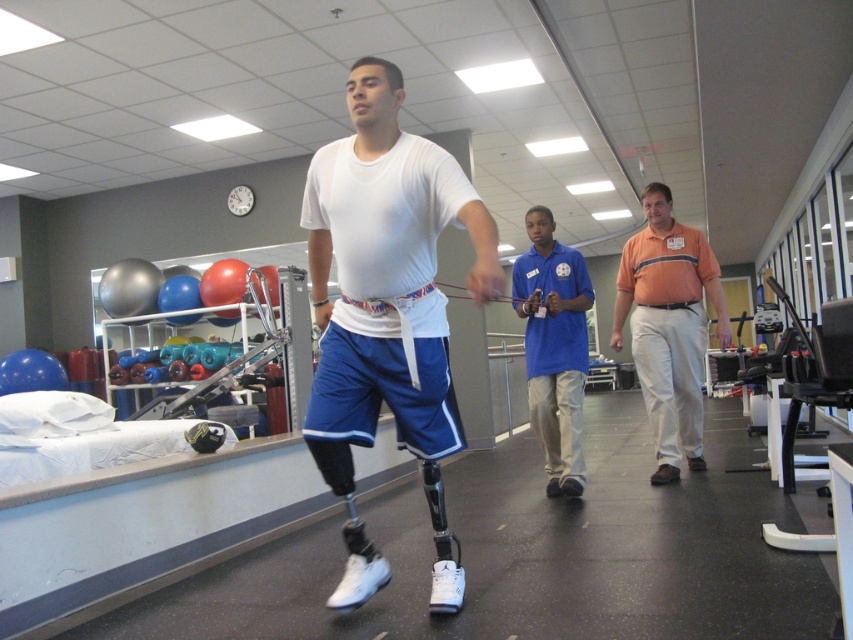
Can you confirm if white matte/soft fabric shirt at center is positioned above blue cotton shirt at center?

Yes.

Is white matte/soft fabric shirt at center below blue cotton shirt at center?

No.

Is point (433, 448) closer to camera compared to point (560, 417)?

Yes, it is.

Where is `white matte/soft fabric shirt at center`? The height and width of the screenshot is (640, 853). white matte/soft fabric shirt at center is located at coordinates (386, 310).

Is point (466, 198) behind point (538, 307)?

No, it is not.

Based on the photo, measure the distance between white matte/soft fabric shirt at center and camera.

white matte/soft fabric shirt at center is 7.30 feet away from camera.

Locate an element on the screen. Image resolution: width=853 pixels, height=640 pixels. white matte/soft fabric shirt at center is located at coordinates (386, 310).

Is orange cotton shirt at center taller than blue cotton shirt at center?

Correct, orange cotton shirt at center is much taller as blue cotton shirt at center.

Which is behind, point (701, 364) or point (548, 460)?

Positioned behind is point (548, 460).

You are a GUI agent. You are given a task and a screenshot of the screen. Output one action in this format:
    pyautogui.click(x=<x>, y=<y>)
    Task: Click on the orange cotton shirt at center
    
    Given the screenshot: What is the action you would take?
    pyautogui.click(x=668, y=326)